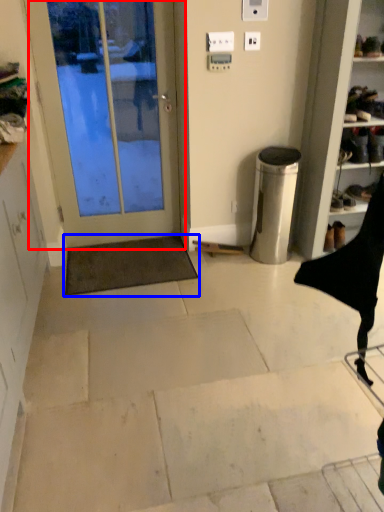
Question: Which object appears closest to the camera in this image, door (highlighted by a red box) or doormat (highlighted by a blue box)?

Choices:
 (A) door
 (B) doormat

Answer: (A)